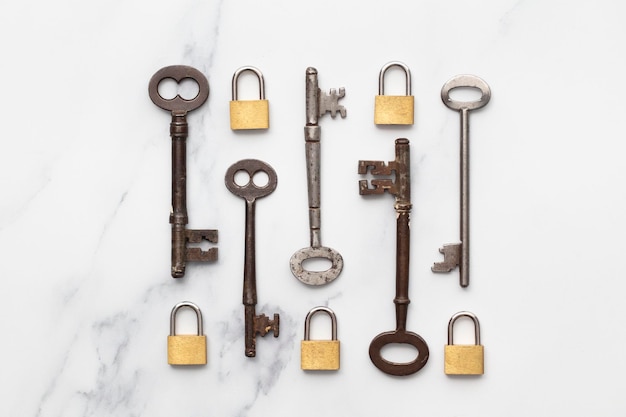
Where is `locks`? locks is located at coordinates (188, 344), (317, 342), (474, 356), (399, 112), (249, 110).